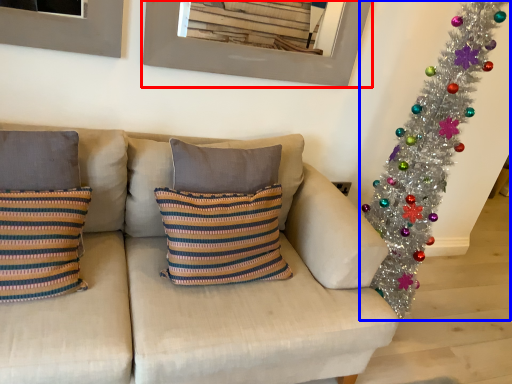
Question: Which object is further to the camera taking this photo, picture frame (highlighted by a red box) or christmas tree (highlighted by a blue box)?

Choices:
 (A) picture frame
 (B) christmas tree

Answer: (A)